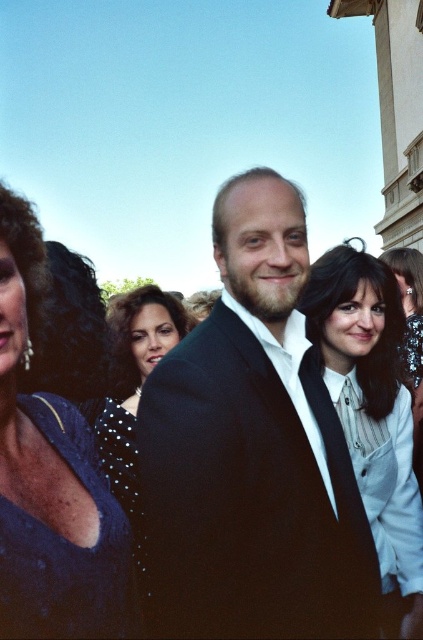
Is white textured shirt at center taller than black dotted dress at center?

Correct, white textured shirt at center is much taller as black dotted dress at center.

Can you confirm if white textured shirt at center is positioned to the right of black dotted dress at center?

Indeed, white textured shirt at center is positioned on the right side of black dotted dress at center.

This screenshot has width=423, height=640. What are the coordinates of `white textured shirt at center` in the screenshot? It's located at (371, 412).

At what (x,y) coordinates should I click in order to perform the action: click on white textured shirt at center. Please return your answer as a coordinate pair (x, y). The height and width of the screenshot is (640, 423). Looking at the image, I should click on (371, 412).

Is matte blue dress at left thinner than black dotted dress at center?

Incorrect, matte blue dress at left's width is not less than black dotted dress at center's.

Can you confirm if matte blue dress at left is positioned to the left of black dotted dress at center?

Yes, matte blue dress at left is to the left of black dotted dress at center.

Does point (38, 493) come behind point (132, 374)?

No.

Identify the location of matte blue dress at left. This screenshot has width=423, height=640. (51, 477).

What do you see at coordinates (252, 452) in the screenshot?
I see `black matte suit at center` at bounding box center [252, 452].

Where is `black matte suit at center`? black matte suit at center is located at coordinates (252, 452).

Between point (264, 387) and point (312, 317), which one is positioned in front?

Positioned in front is point (264, 387).

The width and height of the screenshot is (423, 640). I want to click on black matte suit at center, so click(x=252, y=452).